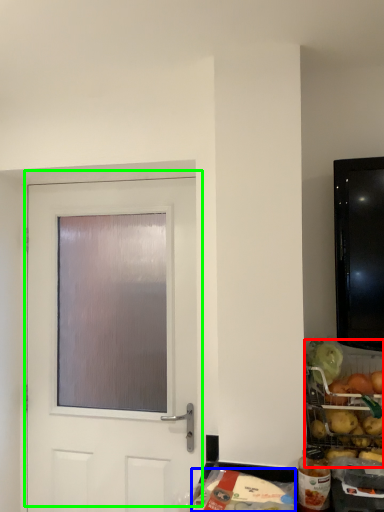
Question: Estimate the real-world distances between objects in this image. Which object is farther from food (highlighted by a red box), food (highlighted by a blue box) or door (highlighted by a green box)?

Choices:
 (A) food
 (B) door

Answer: (B)